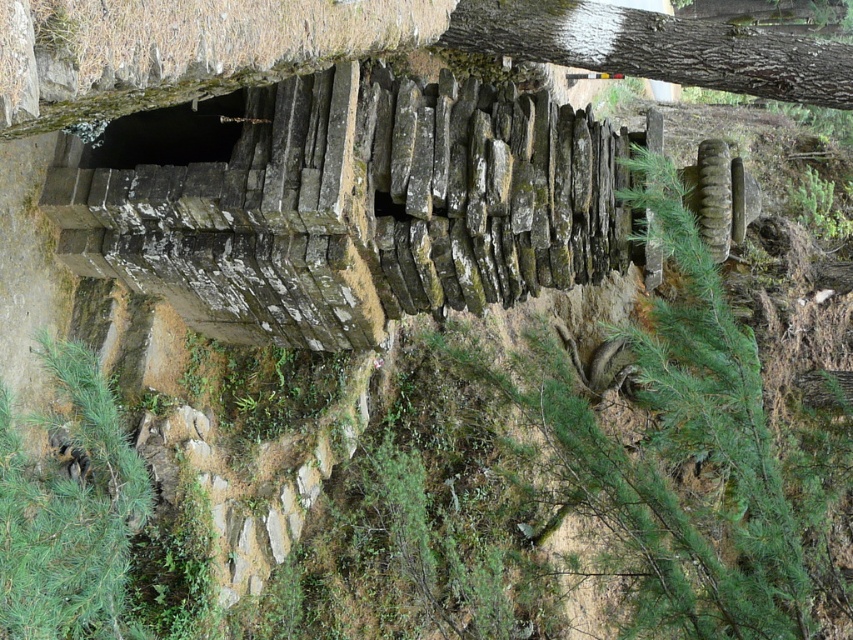
Question: Where is green mossy stone at center located in relation to smooth bark tree trunk at upper right in the image?

Choices:
 (A) below
 (B) above

Answer: (A)

Question: Among these objects, which one is nearest to the camera?

Choices:
 (A) smooth bark tree trunk at upper right
 (B) green mossy stone at center

Answer: (B)

Question: Where is green mossy stone at center located in relation to smooth bark tree trunk at upper right in the image?

Choices:
 (A) below
 (B) above

Answer: (A)

Question: Does green mossy stone at center lie behind smooth bark tree trunk at upper right?

Choices:
 (A) no
 (B) yes

Answer: (A)

Question: Among these objects, which one is nearest to the camera?

Choices:
 (A) green mossy stone at center
 (B) smooth bark tree trunk at upper right

Answer: (A)